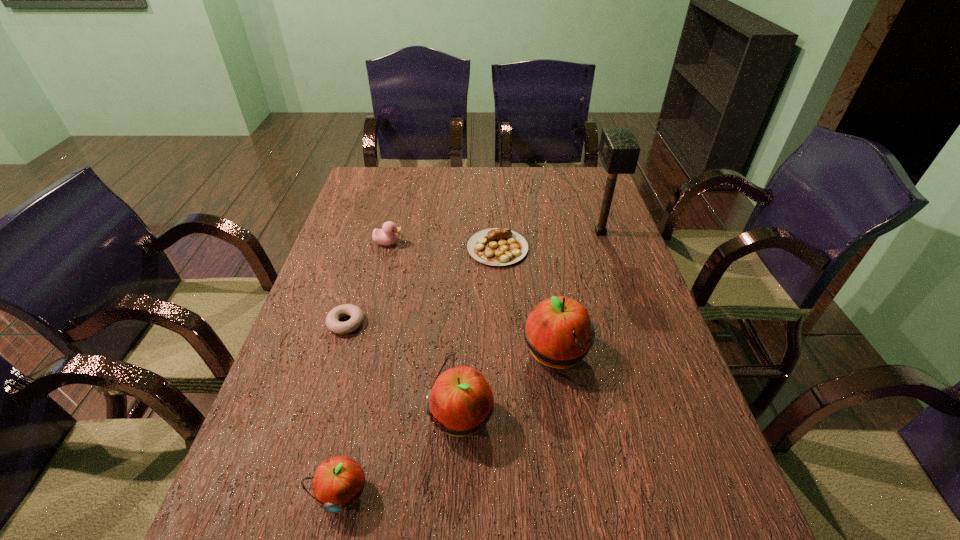
The width and height of the screenshot is (960, 540). Find the location of `the leftmost apple`. the leftmost apple is located at coordinates (338, 482).

Locate an element on the screen. The image size is (960, 540). the fourth shortest object is located at coordinates (338, 482).

This screenshot has height=540, width=960. I want to click on the second shortest apple, so click(x=460, y=402).

At what (x,y) coordinates should I click in order to perform the action: click on the second apple from right to left. Please return your answer as a coordinate pair (x, y). Looking at the image, I should click on (460, 402).

At what (x,y) coordinates should I click in order to perform the action: click on the rightmost apple. Please return your answer as a coordinate pair (x, y). Looking at the image, I should click on (559, 333).

Where is `duckling`? The width and height of the screenshot is (960, 540). duckling is located at coordinates pos(387,235).

Locate an element on the screen. This screenshot has width=960, height=540. steak is located at coordinates (496, 246).

The image size is (960, 540). I want to click on the tallest object, so click(619, 150).

Where is `the rightmost object`? the rightmost object is located at coordinates (619, 150).

At what (x,y) coordinates should I click in order to perform the action: click on the shortest object. Please return your answer as a coordinate pair (x, y). This screenshot has width=960, height=540. Looking at the image, I should click on (333, 324).